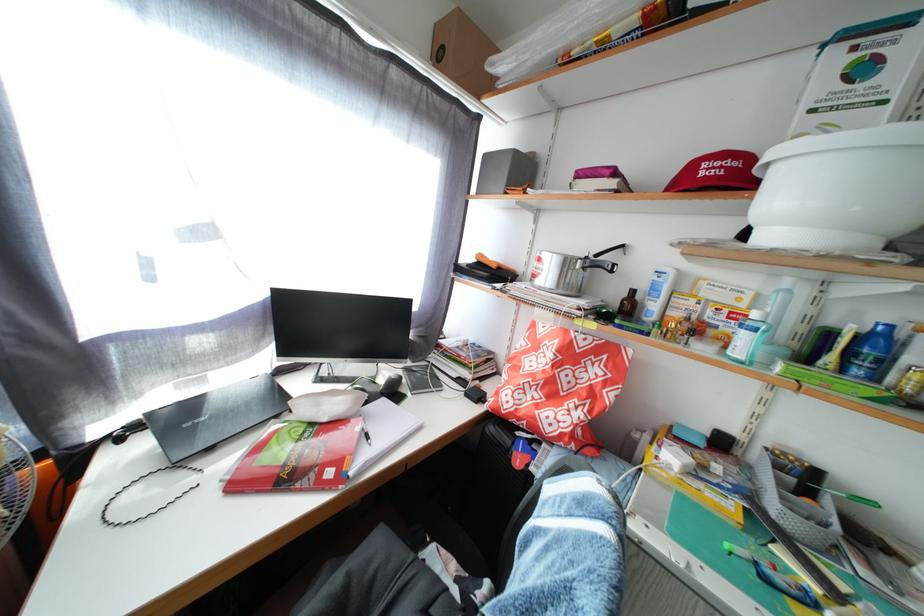
Describe the element at coordinates (214, 416) in the screenshot. The height and width of the screenshot is (616, 924). I see `the grey laptop` at that location.